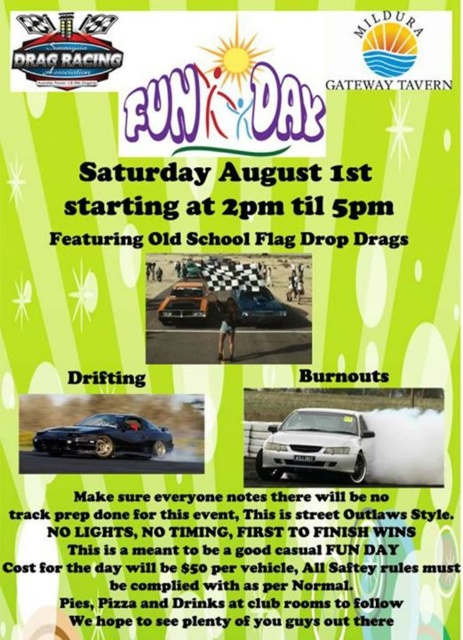
You are planning to attend the drag racing event at the Mildura Gateway Tavern. You see the checkered fabric race track at center and the orange matte car at center in the poster. Based on their positions, which one is positioned lower?

The checkered fabric race track at center is located below the orange matte car at center, so it is positioned lower.